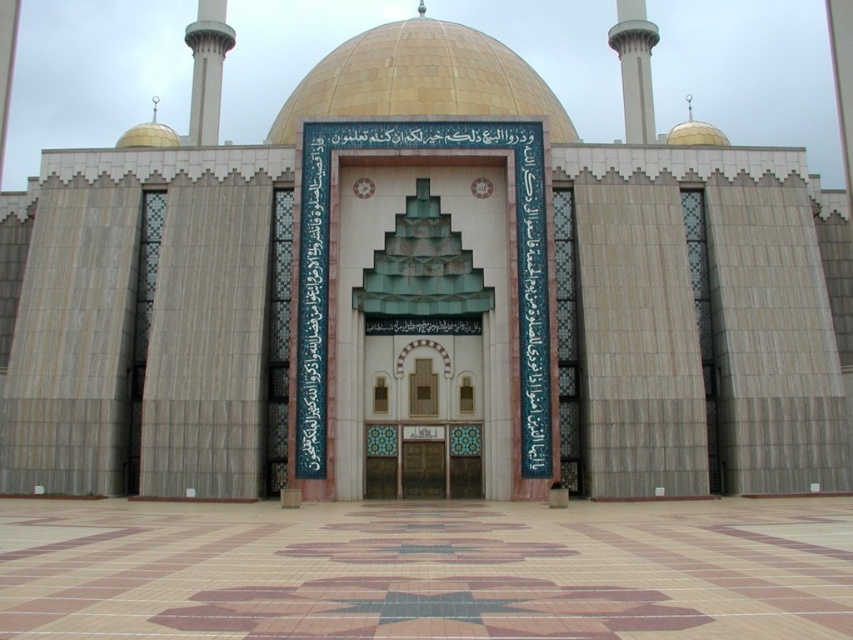
Between gold mosaic dome at center and white concrete minaret at upper center, which one is positioned higher?

white concrete minaret at upper center

Who is lower down, gold mosaic dome at center or white concrete minaret at upper center?

gold mosaic dome at center is below.

Describe the element at coordinates (421, 80) in the screenshot. I see `gold mosaic dome at center` at that location.

At what (x,y) coordinates should I click in order to perform the action: click on gold mosaic dome at center. Please return your answer as a coordinate pair (x, y). Image resolution: width=853 pixels, height=640 pixels. Looking at the image, I should click on (421, 80).

This screenshot has height=640, width=853. I want to click on white concrete minaret at upper center, so click(x=634, y=67).

Is point (641, 131) behind point (192, 86)?

No, (641, 131) is in front of (192, 86).

In order to click on white concrete minaret at upper center in this screenshot , I will do pos(634,67).

Is point (480, 45) closer to viewer compared to point (219, 90)?

That is True.

Can you confirm if gold mosaic dome at center is smaller than white marble minaret at upper left?

No, gold mosaic dome at center is not smaller than white marble minaret at upper left.

Which is in front, point (285, 140) or point (196, 100)?

Point (285, 140)

The height and width of the screenshot is (640, 853). In order to click on gold mosaic dome at center in this screenshot , I will do `click(421, 80)`.